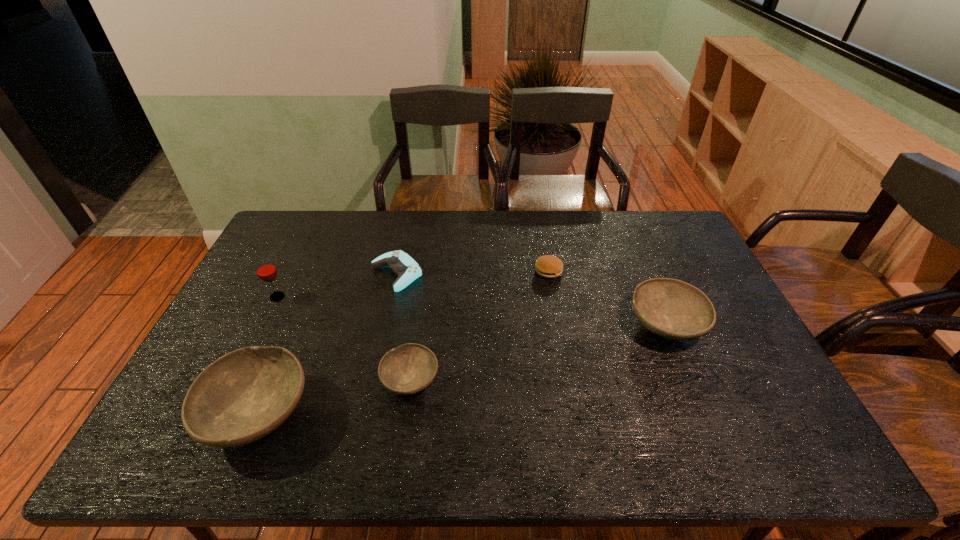
You are a GUI agent. You are given a task and a screenshot of the screen. Output one action in this format:
    pyautogui.click(x=<x>, y=<y>)
    Task: Click on the blank space at the left edge of the desktop
    The width and height of the screenshot is (960, 540).
    Given the screenshot: What is the action you would take?
    pyautogui.click(x=233, y=307)

Locate an element on the screen. vacant space at the right edge of the desktop is located at coordinates (749, 342).

You are a GUI agent. You are given a task and a screenshot of the screen. Output one action in this format:
    pyautogui.click(x=<x>, y=<y>)
    Task: Click on the free space at the far right corner
    Image resolution: width=960 pixels, height=540 pixels.
    Given the screenshot: What is the action you would take?
    pyautogui.click(x=657, y=228)

Locate an element on the screen. The width and height of the screenshot is (960, 540). free space between the control and the leftmost bowl is located at coordinates (x=327, y=343).

This screenshot has width=960, height=540. In order to click on free space between the patty and the tallest object in this screenshot , I will do `click(413, 284)`.

Locate an element on the screen. free point between the control and the tallest object is located at coordinates (337, 285).

Locate an element on the screen. The width and height of the screenshot is (960, 540). vacant area that lies between the leftmost bowl and the shortest bowl is located at coordinates (334, 396).

The image size is (960, 540). Find the location of `unoccupied position between the patty and the control`. unoccupied position between the patty and the control is located at coordinates (472, 272).

You are a GUI agent. You are given a task and a screenshot of the screen. Output one action in this format:
    pyautogui.click(x=<x>, y=<y>)
    Task: Click on the free spot between the third tallest object and the third shortest object
    This screenshot has height=540, width=960.
    Given the screenshot: What is the action you would take?
    pyautogui.click(x=538, y=352)

You are a GUI agent. You are given a task and a screenshot of the screen. Output one action in this format:
    pyautogui.click(x=<x>, y=<y>)
    Task: Click on the free spot between the control and the glass
    The image size is (960, 540).
    Given the screenshot: What is the action you would take?
    pyautogui.click(x=337, y=285)